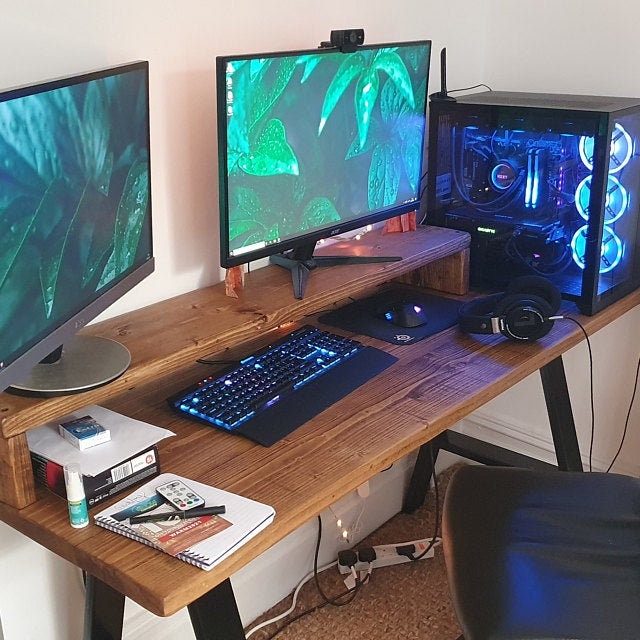
This screenshot has width=640, height=640. Find the location of `floor`. floor is located at coordinates (412, 598).